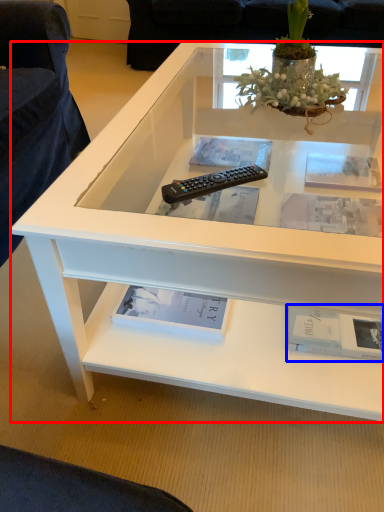
Question: Which of the following is the farthest to the observer, desk (highlighted by a red box) or book (highlighted by a blue box)?

Choices:
 (A) desk
 (B) book

Answer: (B)